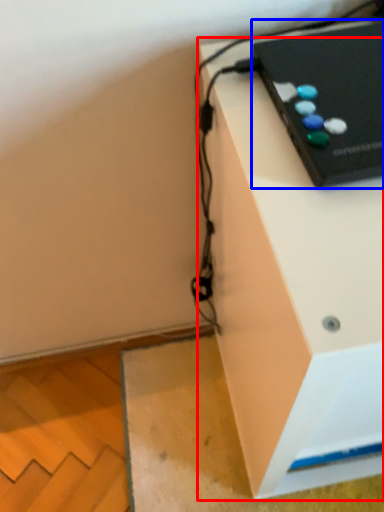
Question: Which point is closer to the camera, furniture (highlighted by a red box) or computer (highlighted by a blue box)?

Choices:
 (A) furniture
 (B) computer

Answer: (A)